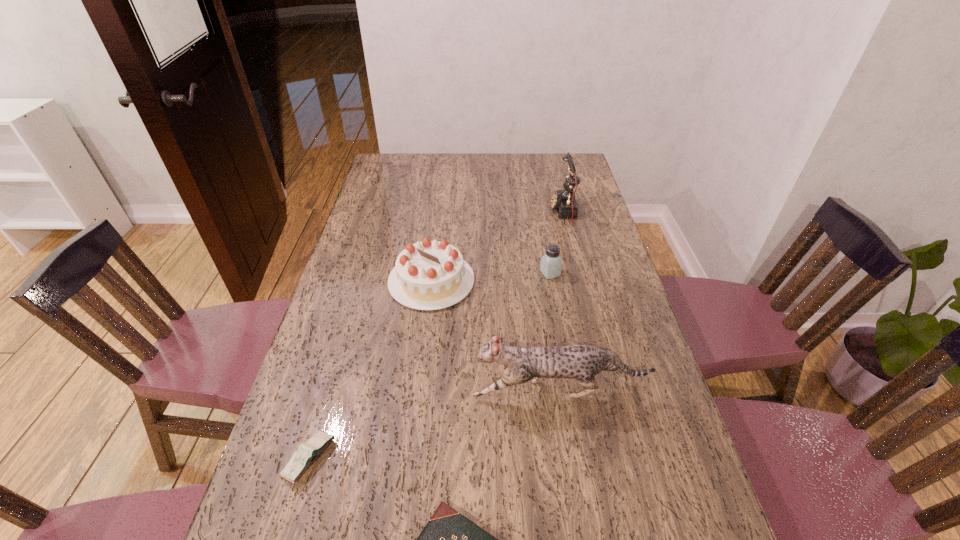
You are a GUI agent. You are given a task and a screenshot of the screen. Output one action in this format:
    pyautogui.click(x=<x>, y=<y>)
    Task: Click on the vacant area situated on the face of the cat
    This screenshot has height=540, width=960.
    Given the screenshot: What is the action you would take?
    pos(447,391)

Locate an element on the screen. The height and width of the screenshot is (540, 960). vacant space situated 0.330m on the face of the cat is located at coordinates (337, 391).

The width and height of the screenshot is (960, 540). I want to click on vacant space located 0.220m on the front of the birthday cake, so click(x=420, y=375).

Where is `blank area located on the back of the fourth tallest object`? The width and height of the screenshot is (960, 540). blank area located on the back of the fourth tallest object is located at coordinates (540, 222).

Locate an element on the screen. vacant region located 0.270m on the right of the leftmost object is located at coordinates (458, 458).

Identify the location of birthday cake positioned at the left edge. (429, 275).

Identify the location of diary that is at the left edge. (307, 453).

This screenshot has height=540, width=960. I want to click on telephone positioned at the right edge, so click(563, 201).

At what (x,y) coordinates should I click in order to perform the action: click on cat that is at the right edge. Please return your answer as a coordinate pair (x, y). The height and width of the screenshot is (540, 960). Looking at the image, I should click on (583, 362).

Find the location of a particular element. This screenshot has height=540, width=960. free space at the far edge of the desktop is located at coordinates (451, 157).